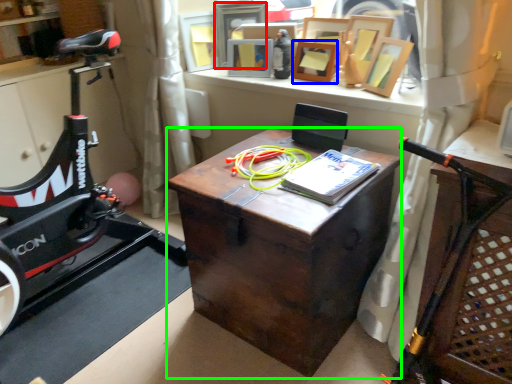
Question: Which object is the closest to the picture frame (highlighted by a red box)? Choose among these: picture frame (highlighted by a blue box) or desk (highlighted by a green box).

Choices:
 (A) picture frame
 (B) desk

Answer: (A)